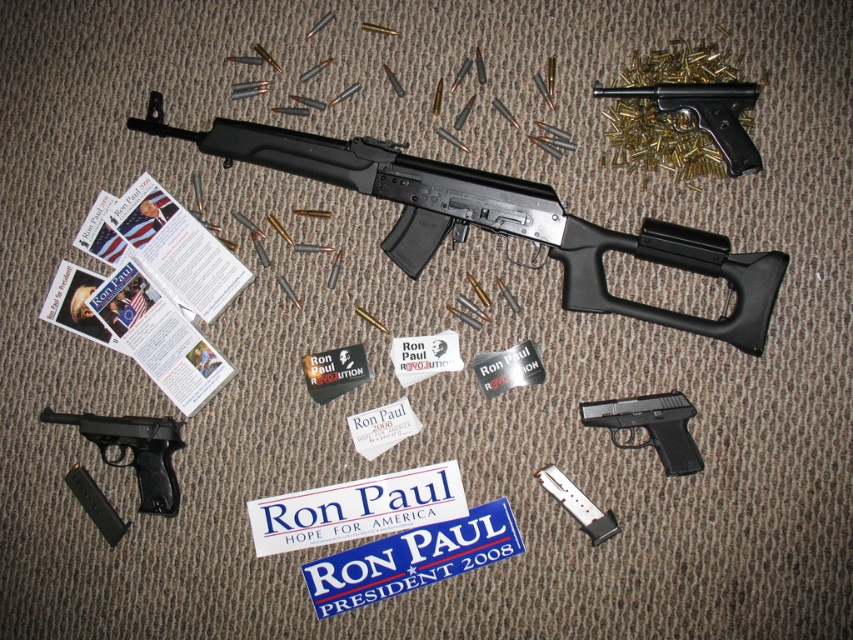
Question: Which point is closer to the camera?

Choices:
 (A) (659, 99)
 (B) (164, 492)

Answer: (A)

Question: In this image, where is black plastic rifle at center located relative to matte black handgun at upper right?

Choices:
 (A) below
 (B) above

Answer: (A)

Question: Observing the image, what is the correct spatial positioning of black plastic rifle at center in reference to black plastic handgun at center?

Choices:
 (A) below
 (B) above

Answer: (B)

Question: Which of these objects is positioned closest to the matte black handgun at upper right?

Choices:
 (A) black plastic rifle at center
 (B) black plastic handgun at lower left

Answer: (A)

Question: Which of the following is the closest to the observer?

Choices:
 (A) (723, 83)
 (B) (149, 486)
 (C) (653, 417)
 (D) (251, 124)

Answer: (A)

Question: Is black plastic handgun at lower left smaller than matte black handgun at upper right?

Choices:
 (A) no
 (B) yes

Answer: (B)